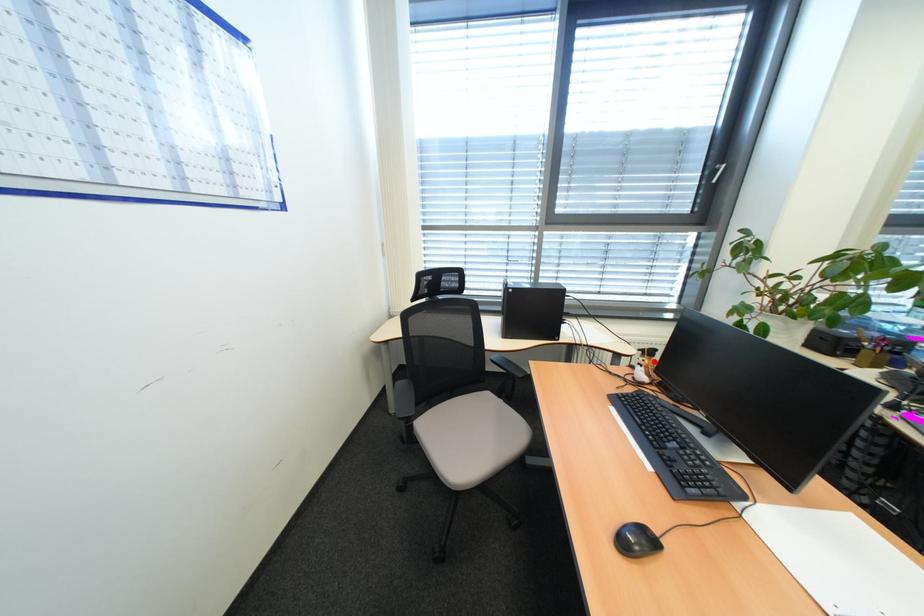
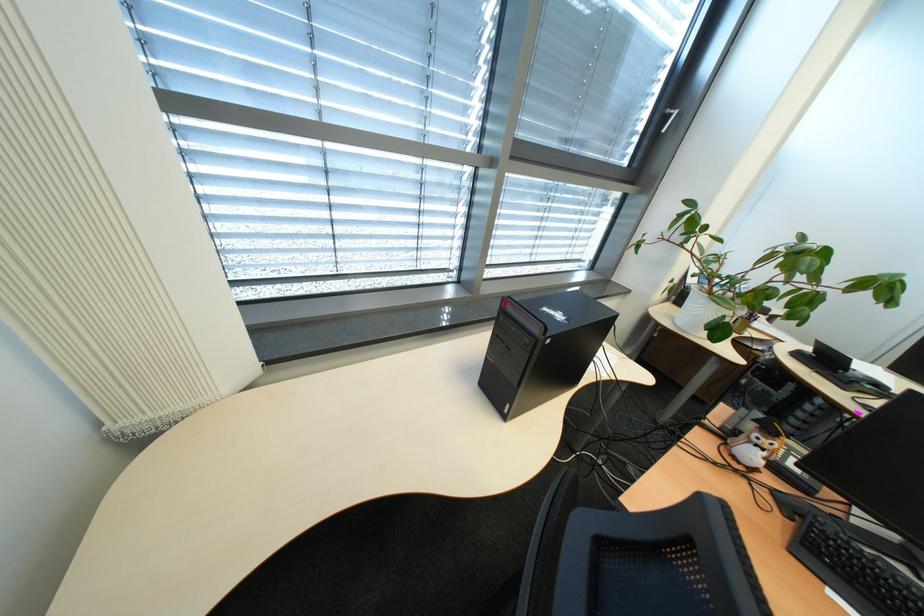
In the second image, find the point that corresponds to the highlighted location in the first image.

(783, 446)